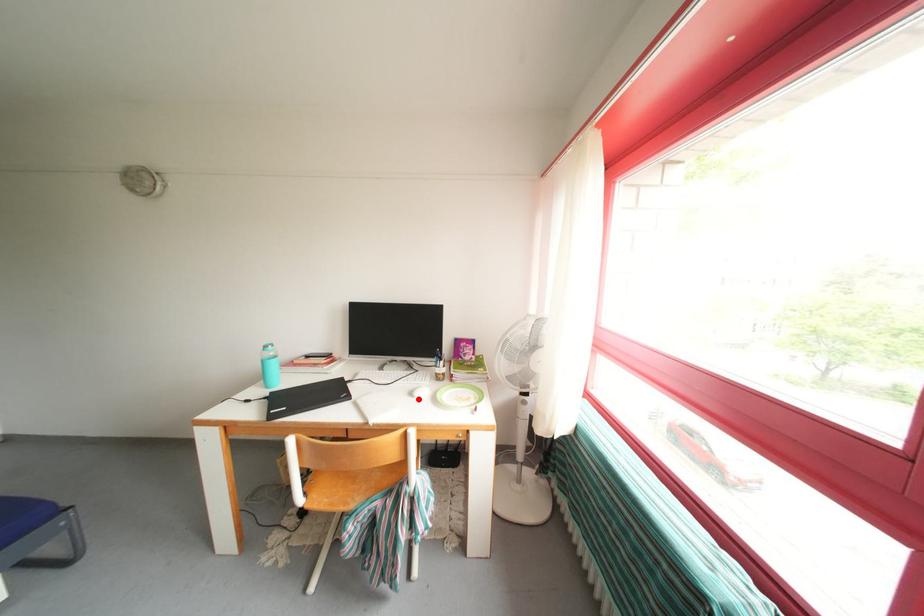
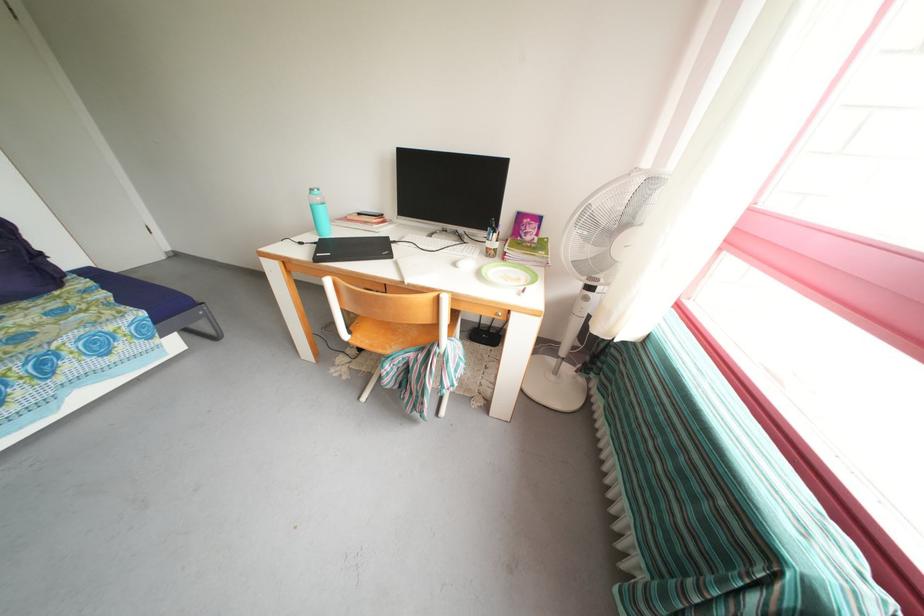
Find the pixel in the second image that matches the highlighted location in the first image.

(462, 269)